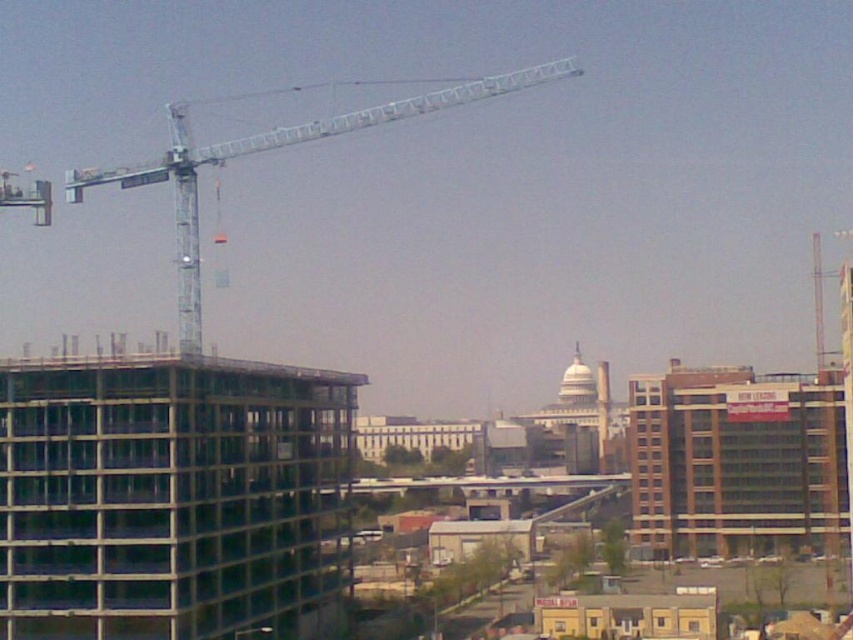
Can you confirm if metallic glass building at left is smaller than metallic silver crane at upper left?

Correct, metallic glass building at left occupies less space than metallic silver crane at upper left.

Between point (321, 552) and point (181, 353), which one is positioned behind?

Positioned behind is point (321, 552).

Is point (119, 593) less distant than point (404, 104)?

Yes, point (119, 593) is closer to viewer.

Find the location of a particular element. metallic glass building at left is located at coordinates (171, 497).